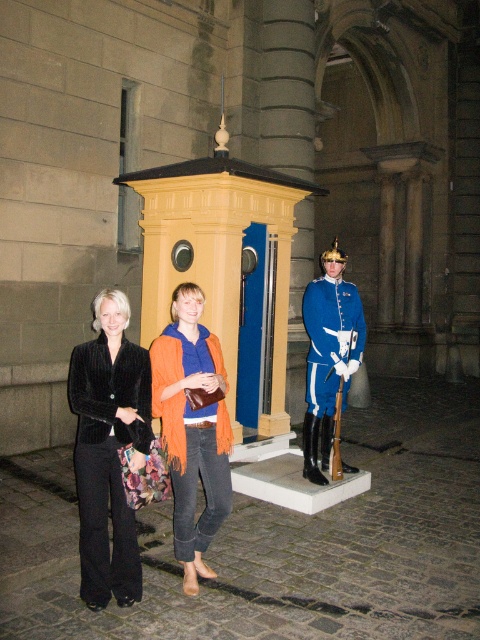
You are a fashion designer observing the two people in the nighttime scene outside the grand stone building. You need to determine which item is narrower between the orange knitted scarf at center and the blue glossy uniform at center. Which one is it?

The orange knitted scarf at center is thinner than the blue glossy uniform at center, so the orange knitted scarf at center is narrower.

You are a costume designer preparing for a play. You need to decide which uniform to choose based on their size. Given that the velvet black uniform at center is smaller than the blue glossy uniform at center, which one should you pick if you want a more compact option?

The velvet black uniform at center occupies less space than the blue glossy uniform at center, so you should choose the velvet black uniform at center for a more compact option.

You are a photographer taking a photo of the two people in front of the grand stone building. You want to focus on the velvet black uniform at center and the orange knitted scarf at center. Which one should you adjust your camera focus to first to ensure both are in sharp focus?

The velvet black uniform at center is closer to the viewer than the orange knitted scarf at center, so you should focus on the velvet black uniform at center first to ensure both are in sharp focus.